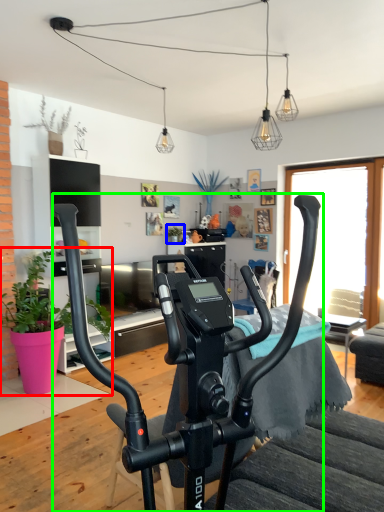
Question: Which object is positioned farthest from houseplant (highlighted by a red box)? Select from houseplant (highlighted by a blue box) and stationary bicycle (highlighted by a green box).

Choices:
 (A) houseplant
 (B) stationary bicycle

Answer: (B)